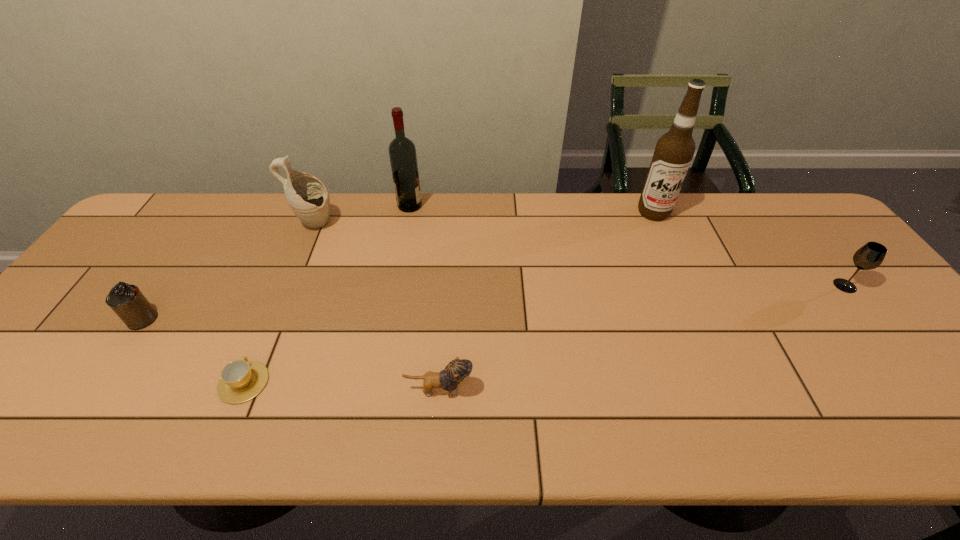
Identify the location of vacant space that satisfies the following two spatial constraints: 1. on the label of the fourth farthest object; 2. on the right side of the right alcohol. (685, 286).

The width and height of the screenshot is (960, 540). Find the location of `vacant space that satisfies the following two spatial constraints: 1. with the handle on the side of the cup; 2. on the left side of the fourth nearest object`. vacant space that satisfies the following two spatial constraints: 1. with the handle on the side of the cup; 2. on the left side of the fourth nearest object is located at coordinates (284, 286).

You are a GUI agent. You are given a task and a screenshot of the screen. Output one action in this format:
    pyautogui.click(x=<x>, y=<y>)
    Task: Click on the vacant position in the image that satisfies the following two spatial constraints: 1. at the spout of the pitcher; 2. on the back side of the fourth tallest object
    This screenshot has width=960, height=540.
    Given the screenshot: What is the action you would take?
    pyautogui.click(x=289, y=286)

Where is `free space that satisfies the following two spatial constraints: 1. on the label of the second object from right to left; 2. at the spout of the pitcher`? The image size is (960, 540). free space that satisfies the following two spatial constraints: 1. on the label of the second object from right to left; 2. at the spout of the pitcher is located at coordinates (659, 225).